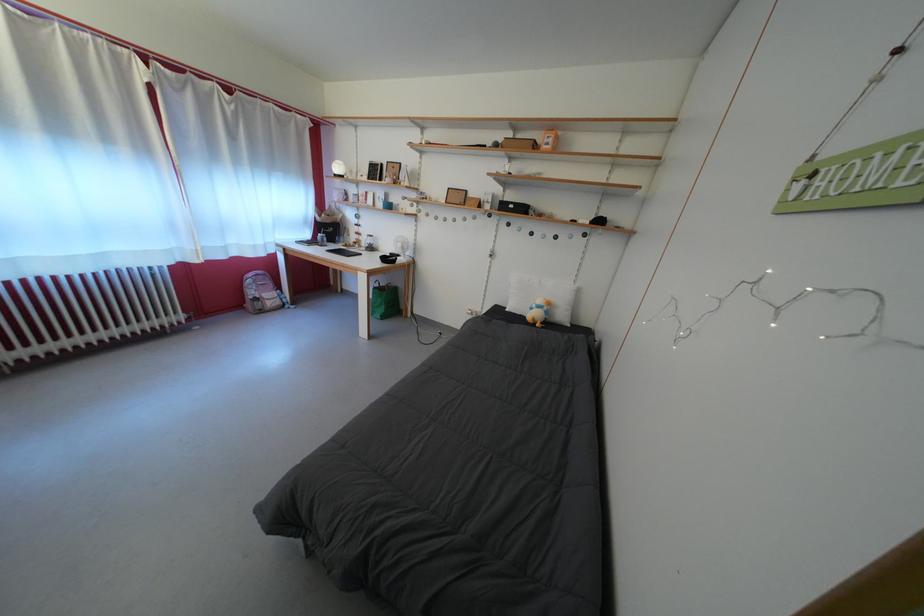
The image size is (924, 616). Identify the location of orange digital clock. (548, 140).